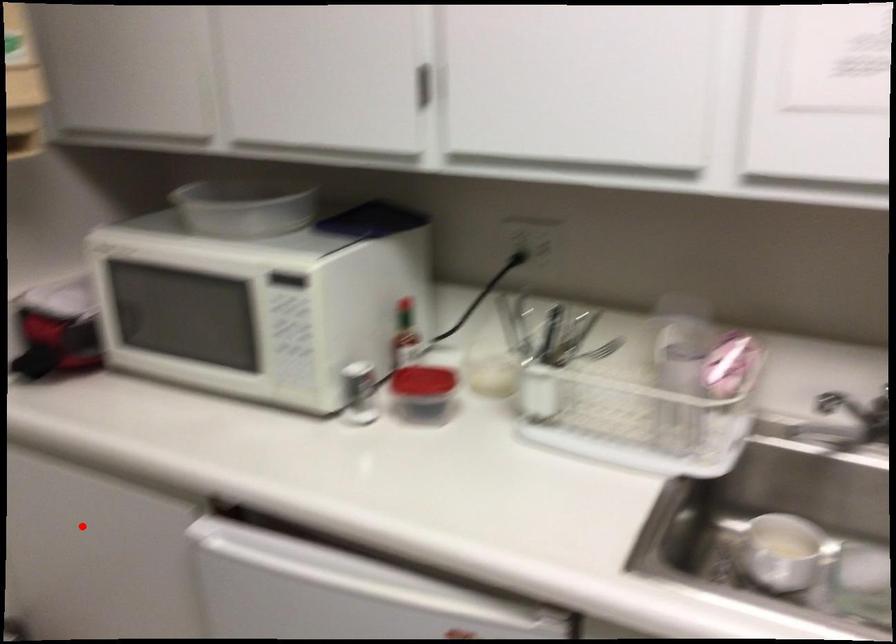
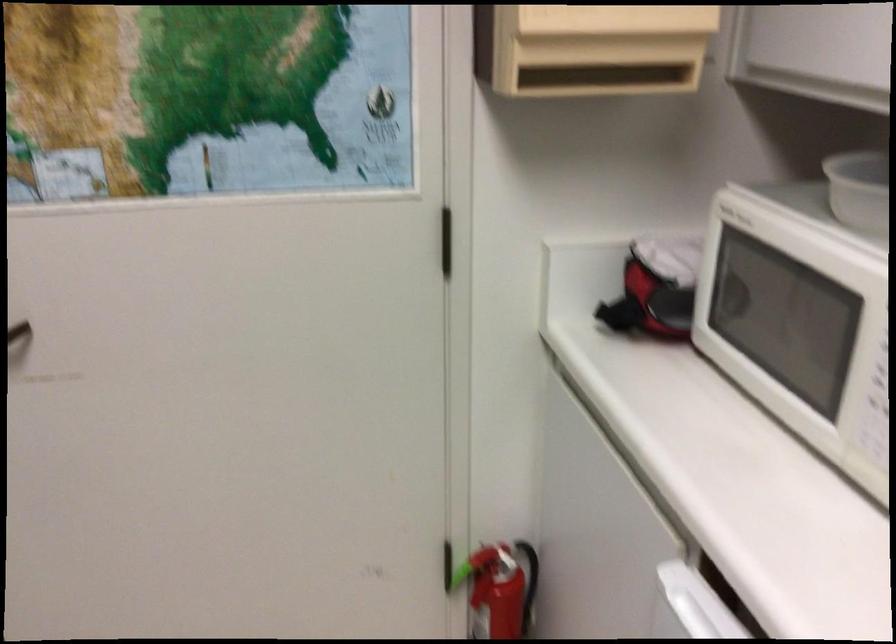
In the second image, find the point that corresponds to the highlighted location in the first image.

(591, 489)